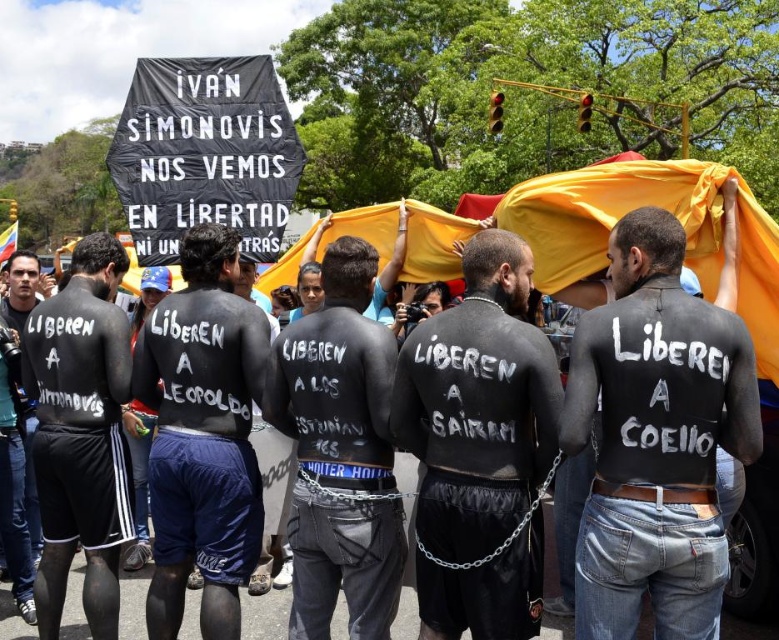
What is the 2D coordinate of the black body paint at center?

The 2D coordinate of the black body paint at center is at point (x=658, y=433).

You are a photographer trying to capture a clear shot of the protesters. You notice two individuals in the crowd with different skin tones. One has black body paint at center and another has dark gray skin at left. Which of these two will appear taller in your photo?

The black body paint at center is taller than dark gray skin at left, so the protester with the black body paint at center will appear taller in the photo.

You are a photographer trying to capture the protest scene. You notice the black body paint at center and the dark gray skin at left in your frame. Which object appears narrower in your photo?

The black body paint at center appears narrower because its width is less than the dark gray skin at left.